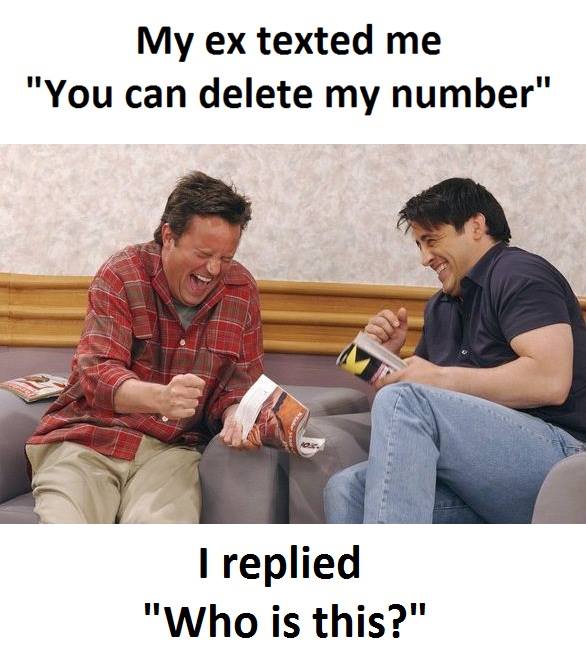
Locate an element on the screen. armchairs is located at coordinates (235, 493), (349, 442).